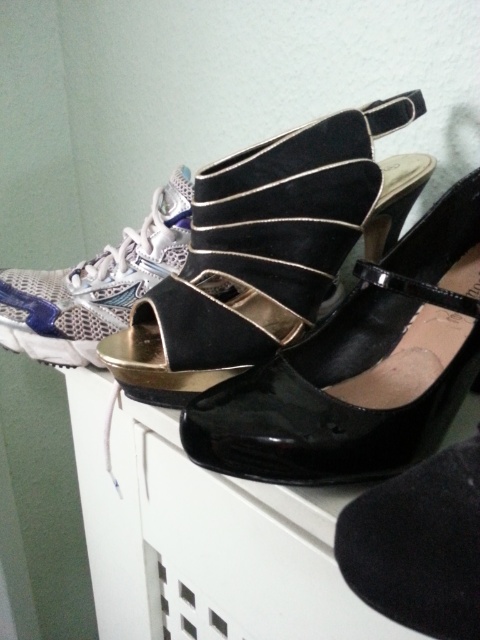
Is point (48, 300) farther from camera compared to point (248, 371)?

Yes, point (48, 300) is behind point (248, 371).

Which is behind, point (311, 266) or point (224, 416)?

Point (311, 266)

Identify the location of suede/leather sandal at center. (250, 244).